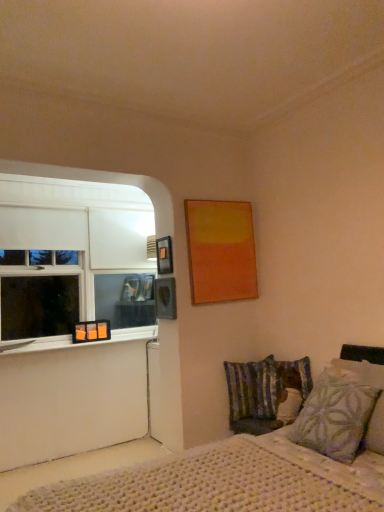
Describe the element at coordinates (91, 331) in the screenshot. I see `orange matte picture frame at window, the 3th picture frame from the right` at that location.

Measure the distance between matte black picture frame at upper left, the second picture frame positioned from the right, and camera.

The distance of matte black picture frame at upper left, the second picture frame positioned from the right, from camera is 3.22 meters.

This screenshot has height=512, width=384. What do you see at coordinates (220, 251) in the screenshot? I see `matte orange painting at upper right, the 1th picture frame in the right-to-left sequence` at bounding box center [220, 251].

What do you see at coordinates (79, 251) in the screenshot? I see `white matte window at left` at bounding box center [79, 251].

At what (x,y) coordinates should I click in order to perform the action: click on orange matte picture frame at window, the first picture frame in the bottom-to-top sequence. Please return your answer as a coordinate pair (x, y). The width and height of the screenshot is (384, 512). Looking at the image, I should click on (91, 331).

In the scene shown: From a real-world perspective, who is located lower, matte black picture frame at upper left, the second picture frame viewed from the left, or striped fabric pillow at lower right, which is counted as the 2th pillow, starting from the front?

From a 3D spatial view, striped fabric pillow at lower right, which is counted as the 2th pillow, starting from the front, is below.

Is matte black picture frame at upper left, the second picture frame positioned from the right, in contact with striped fabric pillow at lower right, placed as the 1th pillow when sorted from back to front?

No, matte black picture frame at upper left, the second picture frame positioned from the right, is not next to striped fabric pillow at lower right, placed as the 1th pillow when sorted from back to front.

Which is more to the right, matte black picture frame at upper left, acting as the 2th picture frame starting from the front, or striped fabric pillow at lower right, which appears as the second pillow when viewed from the right?

Positioned to the right is striped fabric pillow at lower right, which appears as the second pillow when viewed from the right.

Is matte black picture frame at upper left, the second picture frame positioned from the right, positioned far away from orange matte picture frame at window, the first picture frame in the bottom-to-top sequence?

Yes, matte black picture frame at upper left, the second picture frame positioned from the right, and orange matte picture frame at window, the first picture frame in the bottom-to-top sequence, are quite far apart.

Does matte black picture frame at upper left, acting as the 2th picture frame starting from the front, lie behind orange matte picture frame at window, the first picture frame in the bottom-to-top sequence?

No, matte black picture frame at upper left, acting as the 2th picture frame starting from the front, is closer to the viewer.

Is matte black picture frame at upper left, acting as the 2th picture frame starting from the front, not inside orange matte picture frame at window, the 3th picture frame positioned from the front?

That's correct, matte black picture frame at upper left, acting as the 2th picture frame starting from the front, is outside of orange matte picture frame at window, the 3th picture frame positioned from the front.

Which is more to the left, matte black picture frame at upper left, the second picture frame positioned from the right, or orange matte picture frame at window, the 3th picture frame from the right?

orange matte picture frame at window, the 3th picture frame from the right, is more to the left.

In the scene shown: Is striped fabric pillow at lower right, marked as the 1th pillow in a left-to-right arrangement, smaller than white knitted bed at lower right?

Yes, striped fabric pillow at lower right, marked as the 1th pillow in a left-to-right arrangement, is smaller than white knitted bed at lower right.

Based on the photo, is striped fabric pillow at lower right, which is counted as the 2th pillow, starting from the front, oriented towards white knitted bed at lower right?

Yes, striped fabric pillow at lower right, which is counted as the 2th pillow, starting from the front, faces towards white knitted bed at lower right.

Where is `bed in front of the striped fabric pillow at lower right, placed as the 1th pillow when sorted from back to front`? This screenshot has width=384, height=512. bed in front of the striped fabric pillow at lower right, placed as the 1th pillow when sorted from back to front is located at coordinates (193, 475).

What's the angular difference between white knitted bed at lower right and white matte window at left's facing directions?

91.7 degrees.

Is white knitted bed at lower right bigger than white matte window at left?

Yes, white knitted bed at lower right is bigger than white matte window at left.

Is white knitted bed at lower right positioned behind white matte window at left?

No, white knitted bed at lower right is in front of white matte window at left.

Does white knitted bed at lower right turn towards white matte window at left?

No, white knitted bed at lower right is not oriented towards white matte window at left.

Are patterned fabric pillow at lower right, the first pillow when ordered from front to back, and white knitted bed at lower right located far from each other?

Actually, patterned fabric pillow at lower right, the first pillow when ordered from front to back, and white knitted bed at lower right are a little close together.

From a real-world perspective, which is physically below, patterned fabric pillow at lower right, marked as the 2th pillow in a back-to-front arrangement, or white knitted bed at lower right?

white knitted bed at lower right, from a real-world perspective.

Considering the positions of objects patterned fabric pillow at lower right, the 2th pillow positioned from the left, and white knitted bed at lower right in the image provided, who is more to the right, patterned fabric pillow at lower right, the 2th pillow positioned from the left, or white knitted bed at lower right?

From the viewer's perspective, patterned fabric pillow at lower right, the 2th pillow positioned from the left, appears more on the right side.

Could white knitted bed at lower right be considered to be inside patterned fabric pillow at lower right, the first pillow when ordered from front to back?

No, white knitted bed at lower right is located outside of patterned fabric pillow at lower right, the first pillow when ordered from front to back.

From the picture: Does matte orange painting at upper right, arranged as the 3th picture frame when viewed from the back, have a smaller size compared to orange matte picture frame at window, marked as the 1th picture frame in a left-to-right arrangement?

Actually, matte orange painting at upper right, arranged as the 3th picture frame when viewed from the back, might be larger than orange matte picture frame at window, marked as the 1th picture frame in a left-to-right arrangement.

Looking at this image, considering the positions of objects matte orange painting at upper right, which is counted as the third picture frame, starting from the bottom, and orange matte picture frame at window, marked as the 1th picture frame in a left-to-right arrangement, in the image provided, who is more to the right, matte orange painting at upper right, which is counted as the third picture frame, starting from the bottom, or orange matte picture frame at window, marked as the 1th picture frame in a left-to-right arrangement,?

matte orange painting at upper right, which is counted as the third picture frame, starting from the bottom.

Which object is wider, matte orange painting at upper right, which is the first picture frame from top to bottom, or orange matte picture frame at window, marked as the 1th picture frame in a left-to-right arrangement?

With larger width is matte orange painting at upper right, which is the first picture frame from top to bottom.

Is orange matte picture frame at window, the 3th picture frame positioned from the front, not close to matte orange painting at upper right, which is the first picture frame from top to bottom?

orange matte picture frame at window, the 3th picture frame positioned from the front, is far away from matte orange painting at upper right, which is the first picture frame from top to bottom.

Does orange matte picture frame at window, the 3th picture frame in the top-to-bottom sequence, turn towards matte orange painting at upper right, the 1th picture frame in the right-to-left sequence?

No, orange matte picture frame at window, the 3th picture frame in the top-to-bottom sequence, is not aimed at matte orange painting at upper right, the 1th picture frame in the right-to-left sequence.

From the picture: From a real-world perspective, is orange matte picture frame at window, positioned as the 1th picture frame in back-to-front order, on matte orange painting at upper right, the 1th picture frame positioned from the front?

No, from a real-world perspective, orange matte picture frame at window, positioned as the 1th picture frame in back-to-front order, is not above matte orange painting at upper right, the 1th picture frame positioned from the front.

Locate an element on the screen. picture frame that is the 2nd object to the right of the orange matte picture frame at window, marked as the 1th picture frame in a left-to-right arrangement, starting at the anchor is located at coordinates (220, 251).

From the image's perspective, which picture frame is the 2nd one above the striped fabric pillow at lower right, which appears as the second pillow when viewed from the right? Please provide its 2D coordinates.

[(164, 255)]

Identify the location of picture frame below the matte black picture frame at upper left, acting as the second picture frame starting from the bottom (from a real-world perspective). The image size is (384, 512). pos(91,331).

Considering their positions, is white matte window at left positioned closer to orange matte picture frame at window, marked as the 1th picture frame in a left-to-right arrangement, than patterned fabric pillow at lower right, the first pillow when ordered from front to back?

white matte window at left is closer to orange matte picture frame at window, marked as the 1th picture frame in a left-to-right arrangement.

When comparing their distances from matte orange painting at upper right, arranged as the 3th picture frame when viewed from the back, does white matte window at left or matte black picture frame at upper left, the second picture frame viewed from the top, seem closer?

matte black picture frame at upper left, the second picture frame viewed from the top, lies closer to matte orange painting at upper right, arranged as the 3th picture frame when viewed from the back, than the other object.

When comparing their distances from patterned fabric pillow at lower right, marked as the 2th pillow in a back-to-front arrangement, does white matte window at left or matte orange painting at upper right, which is counted as the third picture frame, starting from the bottom, seem further?

Among the two, white matte window at left is located further to patterned fabric pillow at lower right, marked as the 2th pillow in a back-to-front arrangement.

Which object lies further to the anchor point matte black picture frame at upper left, the second picture frame positioned from the right, striped fabric pillow at lower right, placed as the 1th pillow when sorted from back to front, or orange matte picture frame at window, the 3th picture frame from the right?

The object further to matte black picture frame at upper left, the second picture frame positioned from the right, is orange matte picture frame at window, the 3th picture frame from the right.

From the image, which object appears to be farther from white matte window at left, striped fabric pillow at lower right, which is counted as the 2th pillow, starting from the front, or white knitted bed at lower right?

Among the two, white knitted bed at lower right is located further to white matte window at left.

Estimate the real-world distances between objects in this image. Which object is further from striped fabric pillow at lower right, marked as the 1th pillow in a left-to-right arrangement, white knitted bed at lower right or matte orange painting at upper right, arranged as the 3th picture frame when viewed from the back?

white knitted bed at lower right lies further to striped fabric pillow at lower right, marked as the 1th pillow in a left-to-right arrangement, than the other object.

Which object lies further to the anchor point clear glass window sill at lower left, white knitted bed at lower right or striped fabric pillow at lower right, placed as the 1th pillow when sorted from back to front?

white knitted bed at lower right.

When comparing their distances from clear glass window sill at lower left, does orange matte picture frame at window, the 3th picture frame positioned from the front, or striped fabric pillow at lower right, marked as the 1th pillow in a left-to-right arrangement, seem closer?

orange matte picture frame at window, the 3th picture frame positioned from the front.

The image size is (384, 512). I want to click on picture frame between white matte window at left and clear glass window sill at lower left in the up-down direction, so click(91, 331).

At what (x,y) coordinates should I click in order to perform the action: click on pillow positioned between patterned fabric pillow at lower right, marked as the 2th pillow in a back-to-front arrangement, and matte black picture frame at upper left, the second picture frame positioned from the right, from near to far. Please return your answer as a coordinate pair (x, y). This screenshot has height=512, width=384. Looking at the image, I should click on (253, 389).

You are a GUI agent. You are given a task and a screenshot of the screen. Output one action in this format:
    pyautogui.click(x=<x>, y=<y>)
    Task: Click on the window sill located between white matte window at left and matte orange painting at upper right, which is counted as the third picture frame, starting from the bottom, in the left-right direction
    
    Given the screenshot: What is the action you would take?
    pyautogui.click(x=87, y=342)

What are the coordinates of `pillow between white matte window at left and patterned fabric pillow at lower right, marked as the first pillow in a right-to-left arrangement` in the screenshot? It's located at (253, 389).